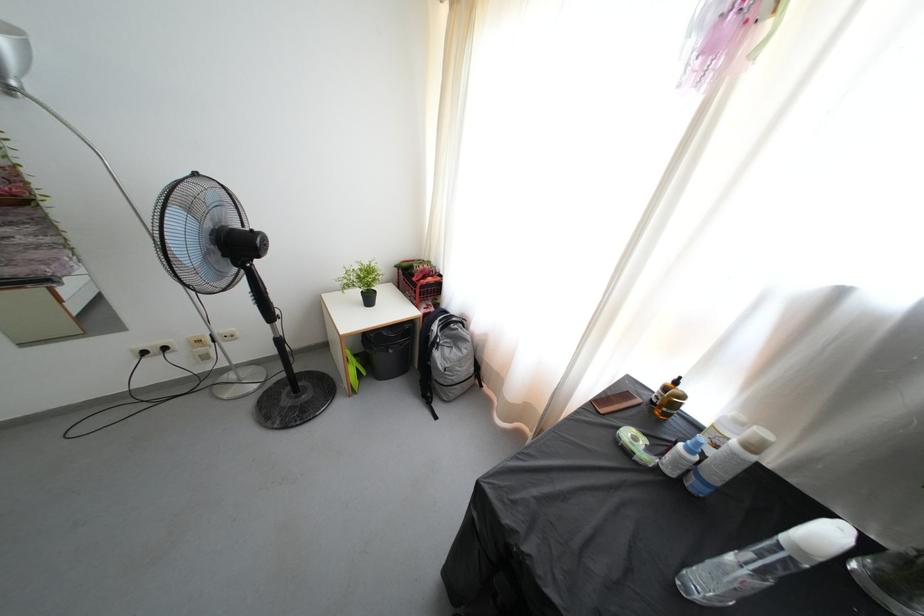
The image size is (924, 616). What are the coordinates of `white spray nozzle` in the screenshot? It's located at (819, 540).